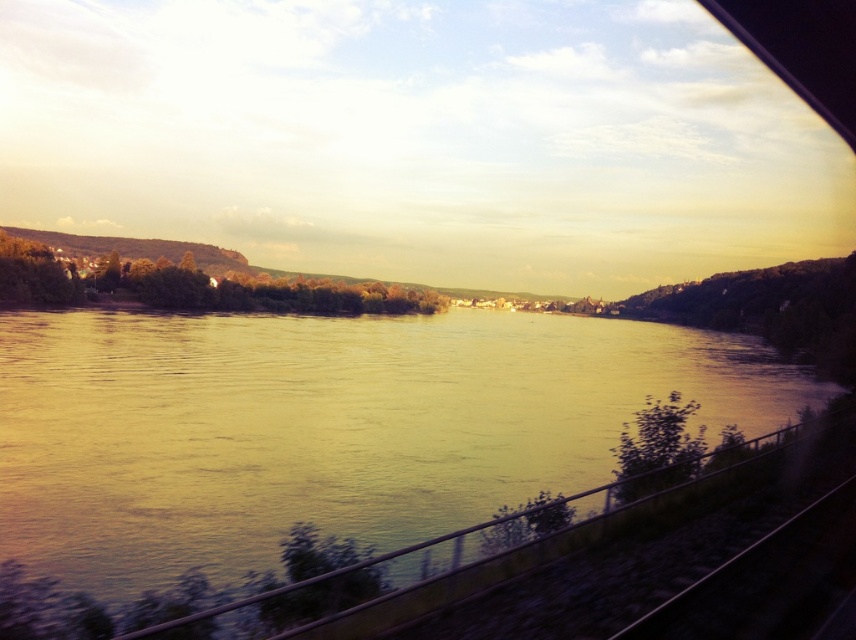
Question: Is yellowish water at center below black metal train track at lower right?

Choices:
 (A) no
 (B) yes

Answer: (A)

Question: Among these objects, which one is nearest to the camera?

Choices:
 (A) black metal train track at lower right
 (B) yellowish water at center

Answer: (A)

Question: Is yellowish water at center bigger than black metal train track at lower right?

Choices:
 (A) yes
 (B) no

Answer: (A)

Question: Can you confirm if yellowish water at center is smaller than black metal train track at lower right?

Choices:
 (A) yes
 (B) no

Answer: (B)